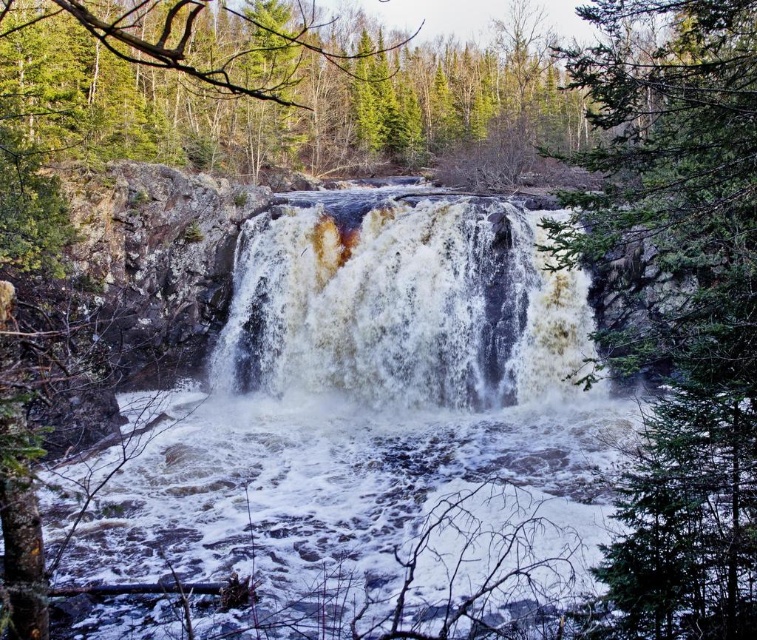
You are a hiker who wants to cross the white frothy water at center using a 6 meter long wooden plank. There is a green textured pine tree at center nearby. Can you safely place the plank between them to cross?

The distance between the green textured pine tree at center and the white frothy water at center is 6.53 meters. Since the wooden plank is only 6 meters long, it would be too short to bridge the gap. You cannot safely place the plank between them to cross.

You are standing at the base of the waterfall and want to take a photo of the green textured pine tree at center. Your camera can focus on objects up to 20 feet away. Will the tree be in focus?

The green textured pine tree at center is 16.01 feet away from the camera, which is within the camera focus range of up to 20 feet. Therefore, the tree will be in focus.

Looking at this image, you are standing at the base of the waterfall and want to determine which of the two points, point [712,356] or point [540,342], is closer to you. Which one should you choose?

Point [712,356] is closer to the viewer than point [540,342], so you should choose point [712,356].